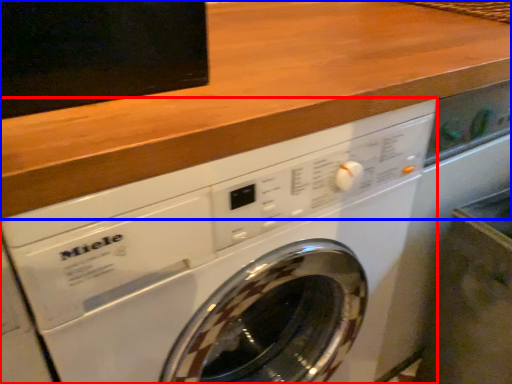
Question: Which object appears farthest to the camera in this image, washing machine (highlighted by a red box) or counter top (highlighted by a blue box)?

Choices:
 (A) washing machine
 (B) counter top

Answer: (A)